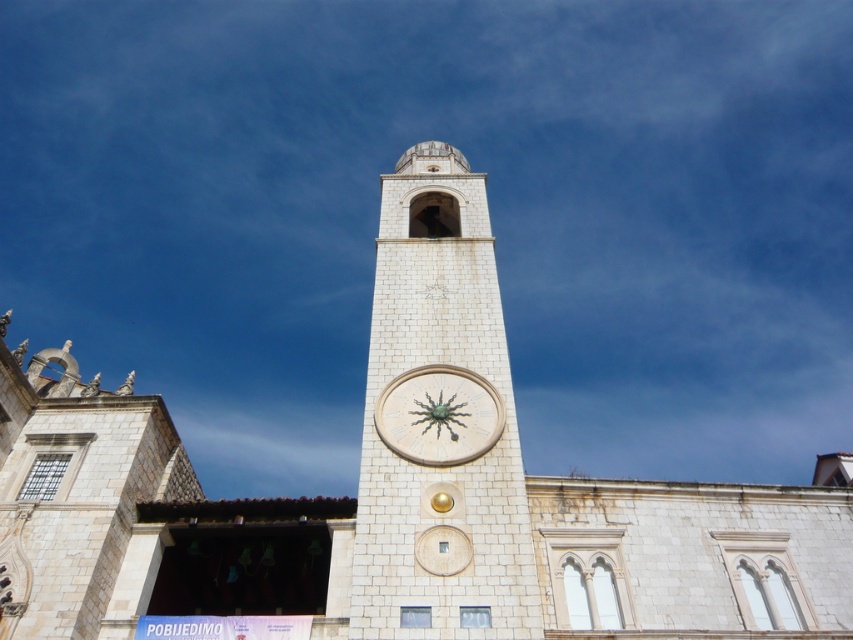
Is white stone clock tower at center taller than white stone clock at center?

Yes.

Can you confirm if white stone clock tower at center is positioned above white stone clock at center?

Correct, white stone clock tower at center is located above white stone clock at center.

Which is behind, point (402, 188) or point (409, 387)?

The point (402, 188) is more distant.

The height and width of the screenshot is (640, 853). What are the coordinates of `white stone clock tower at center` in the screenshot? It's located at (439, 422).